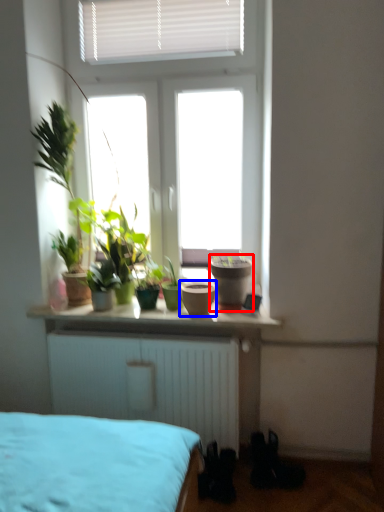
Question: Which object is closer to the camera taking this photo, flowerpot (highlighted by a red box) or flowerpot (highlighted by a blue box)?

Choices:
 (A) flowerpot
 (B) flowerpot

Answer: (B)